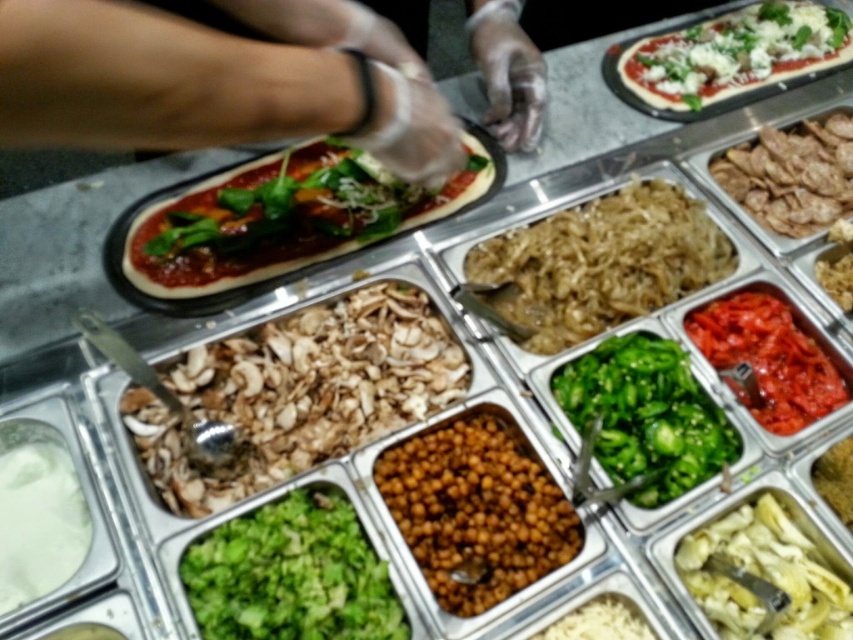
Does green leafymaterial/texture at position appear on the left side of white glossy artichoke at lower right?

Indeed, green leafymaterial/texture at position is positioned on the left side of white glossy artichoke at lower right.

Does green leafymaterial/texture at position have a smaller size compared to white glossy artichoke at lower right?

No.

Where is `green leafymaterial/texture at position`? This screenshot has width=853, height=640. green leafymaterial/texture at position is located at coordinates (291, 573).

Locate an element on the screen. The width and height of the screenshot is (853, 640). green leafymaterial/texture at position is located at coordinates (291, 573).

Does point (242, 416) come farther from viewer compared to point (848, 492)?

No.

Is white shelled mushrooms at center to the right of brown crumbly topping at center from the viewer's perspective?

Incorrect, white shelled mushrooms at center is not on the right side of brown crumbly topping at center.

At what (x,y) coordinates should I click in order to perform the action: click on white shelled mushrooms at center. Please return your answer as a coordinate pair (x, y). The height and width of the screenshot is (640, 853). Looking at the image, I should click on (299, 392).

How distant is clear plastic gloves at center from white shelled mushrooms at center?

34.98 centimeters

Is clear plastic gloves at center to the left of white shelled mushrooms at center from the viewer's perspective?

Indeed, clear plastic gloves at center is positioned on the left side of white shelled mushrooms at center.

Where is `clear plastic gloves at center`? Image resolution: width=853 pixels, height=640 pixels. clear plastic gloves at center is located at coordinates (181, 72).